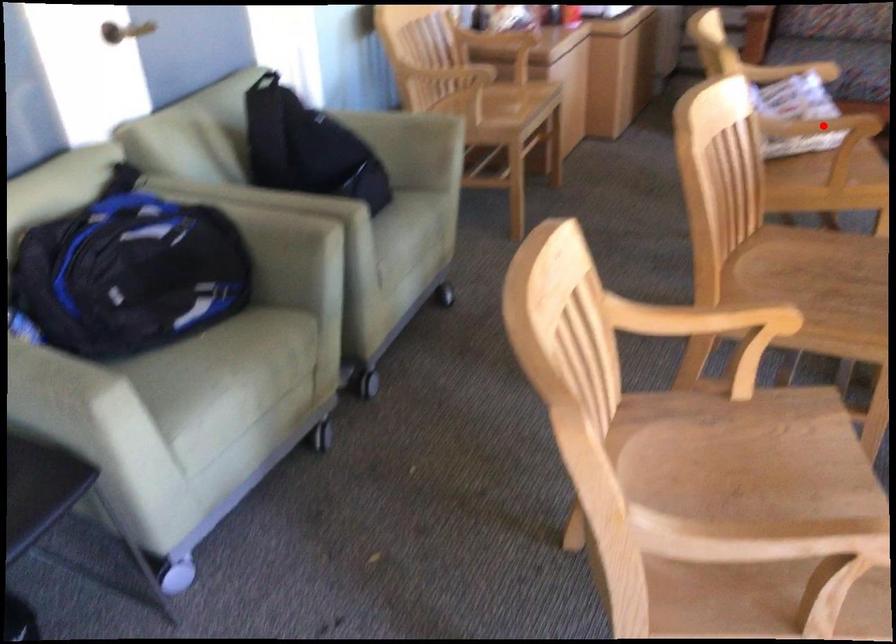
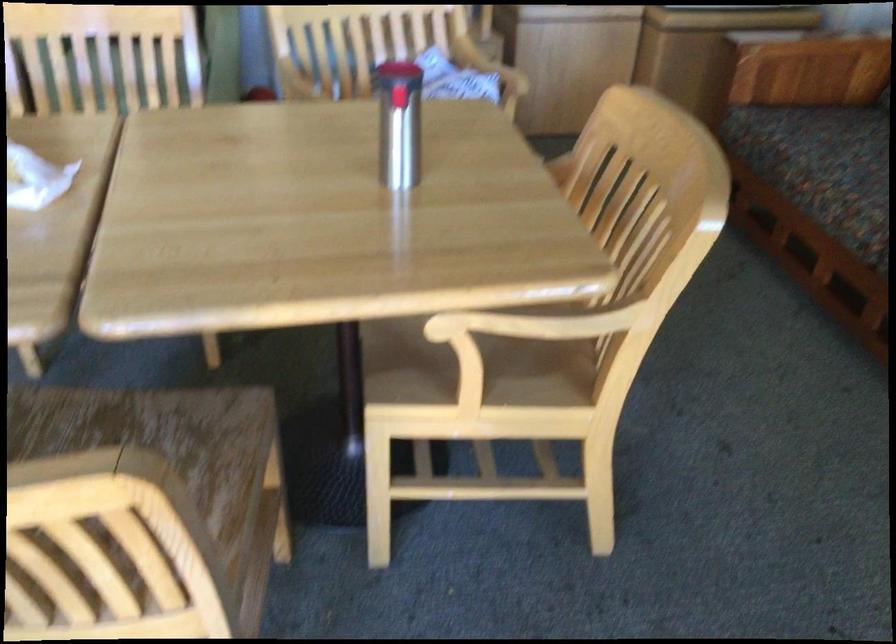
Question: I am providing you with two images of the same scene from different viewpoints. A red point is marked on the first image. Is the red point's position out of view in image 2?

Choices:
 (A) Yes
 (B) No

Answer: (A)